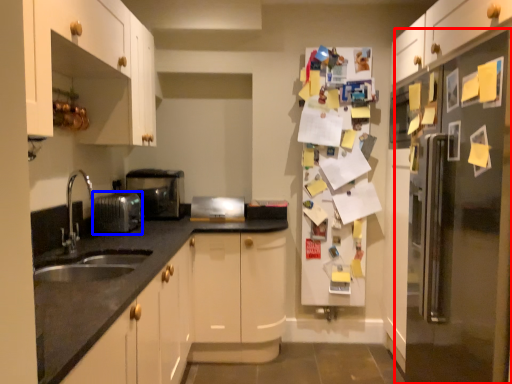
Question: Which point is further to the camera, fridge (highlighted by a red box) or appliance (highlighted by a blue box)?

Choices:
 (A) fridge
 (B) appliance

Answer: (B)